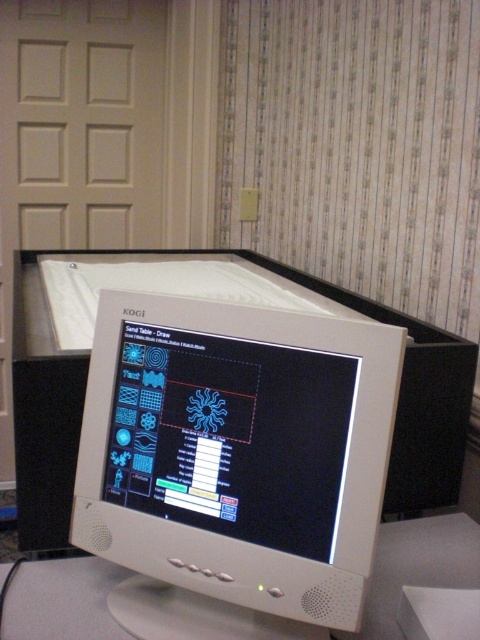
Question: Among these points, which one is farthest from the camera?

Choices:
 (A) pos(81,632)
 (B) pos(142,461)

Answer: (B)

Question: Is white plastic monitor at center above white plastic computer desk at center?

Choices:
 (A) yes
 (B) no

Answer: (A)

Question: Is the position of white plastic monitor at center more distant than that of white plastic computer desk at center?

Choices:
 (A) no
 (B) yes

Answer: (A)

Question: Which of the following is the farthest from the observer?

Choices:
 (A) white plastic computer desk at center
 (B) white plastic monitor at center

Answer: (A)

Question: Is white plastic monitor at center above white plastic computer desk at center?

Choices:
 (A) yes
 (B) no

Answer: (A)

Question: Which object is closer to the camera taking this photo?

Choices:
 (A) white plastic computer desk at center
 (B) white plastic monitor at center

Answer: (B)